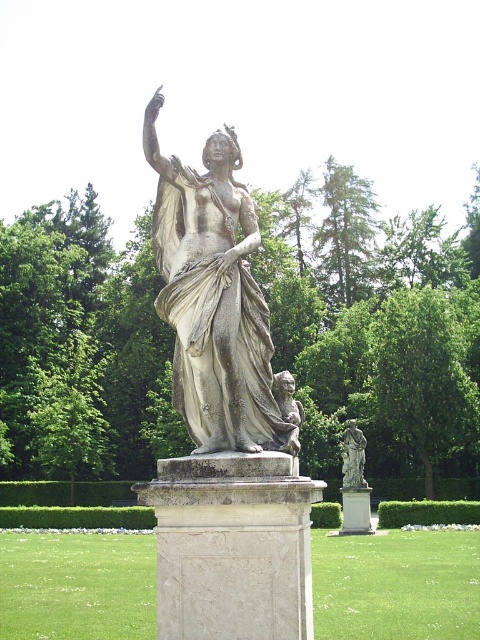
Question: Can you confirm if matte gray statue at center is thinner than white marble pillar at center?

Choices:
 (A) no
 (B) yes

Answer: (A)

Question: Is matte gray statue at center positioned behind white marble pillar at center?

Choices:
 (A) yes
 (B) no

Answer: (B)

Question: Is matte gray statue at center positioned behind white marble statue at center?

Choices:
 (A) no
 (B) yes

Answer: (A)

Question: Among these objects, which one is farthest from the camera?

Choices:
 (A) matte gray statue at center
 (B) white marble pillar at center

Answer: (B)

Question: Which point is farther to the camera?

Choices:
 (A) (346, 452)
 (B) (359, 509)
 (C) (163, 296)

Answer: (A)

Question: Which point is closer to the camera?

Choices:
 (A) white marble statue at center
 (B) matte gray statue at center
 (C) white marble pillar at center

Answer: (B)